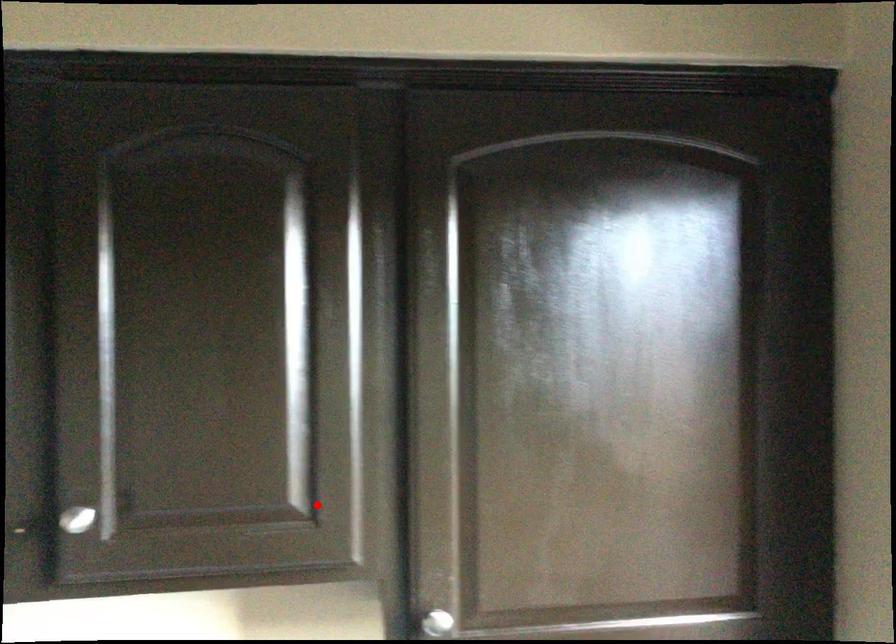
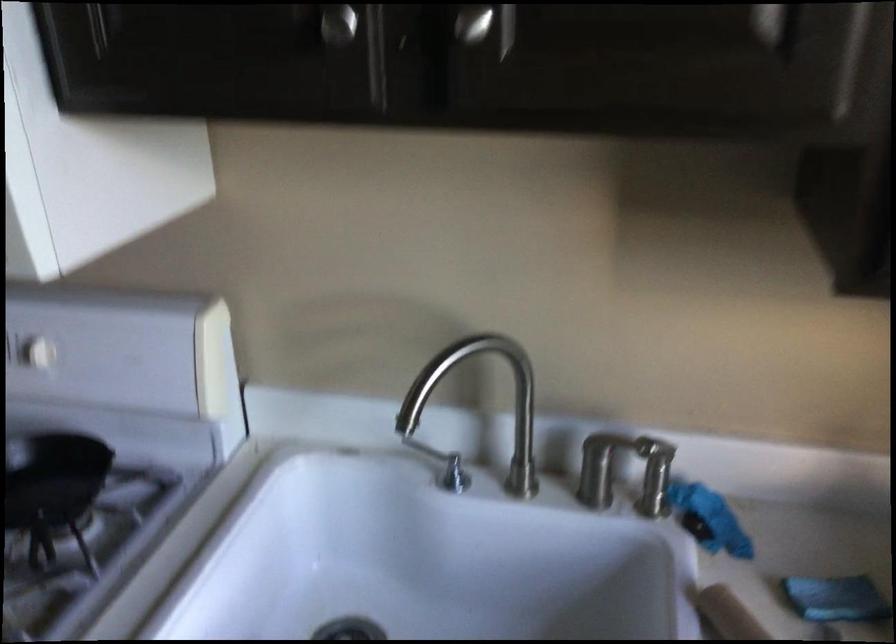
Question: I am providing you with two images of the same scene from different viewpoints. Given a red point in image1, look at the same physical point in image2. Is it:

Choices:
 (A) Closer to the viewpoint
 (B) Farther from the viewpoint

Answer: (A)